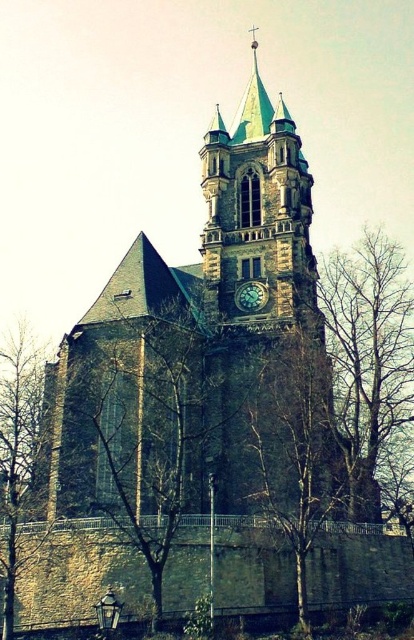
Who is taller, bare wood tree at center or bare branches at left?

With more height is bare branches at left.

Is bare wood tree at center to the left of bare branches at left from the viewer's perspective?

Incorrect, bare wood tree at center is not on the left side of bare branches at left.

At what (x,y) coordinates should I click in order to perform the action: click on bare wood tree at center. Please return your answer as a coordinate pair (x, y). The image size is (414, 640). Looking at the image, I should click on (293, 444).

Locate an element on the screen. This screenshot has height=640, width=414. bare wood tree at center is located at coordinates (293, 444).

Does point (341, 388) lie behind point (36, 416)?

That is False.

Does brown textured tree at right appear under bare branches at left?

No.

This screenshot has height=640, width=414. I want to click on brown textured tree at right, so click(x=368, y=356).

Who is lower down, brown textured tree at right or bare wood tree at center?

bare wood tree at center is lower down.

Between brown textured tree at right and bare wood tree at center, which one appears on the right side from the viewer's perspective?

From the viewer's perspective, brown textured tree at right appears more on the right side.

Is point (360, 436) less distant than point (283, 339)?

That is False.

Where is `brown textured tree at right`? The width and height of the screenshot is (414, 640). brown textured tree at right is located at coordinates (368, 356).